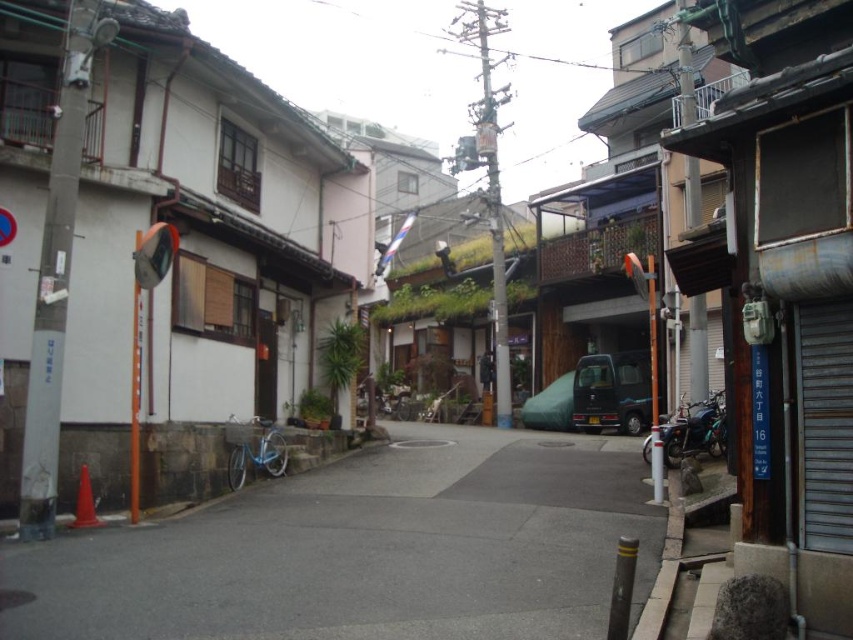
Is point (169, 625) more distant than point (553, 381)?

That is False.

This screenshot has width=853, height=640. What do you see at coordinates (364, 548) in the screenshot?
I see `smooth concrete sidewalk at center` at bounding box center [364, 548].

This screenshot has height=640, width=853. Find the location of `smooth concrete sidewalk at center`. smooth concrete sidewalk at center is located at coordinates (364, 548).